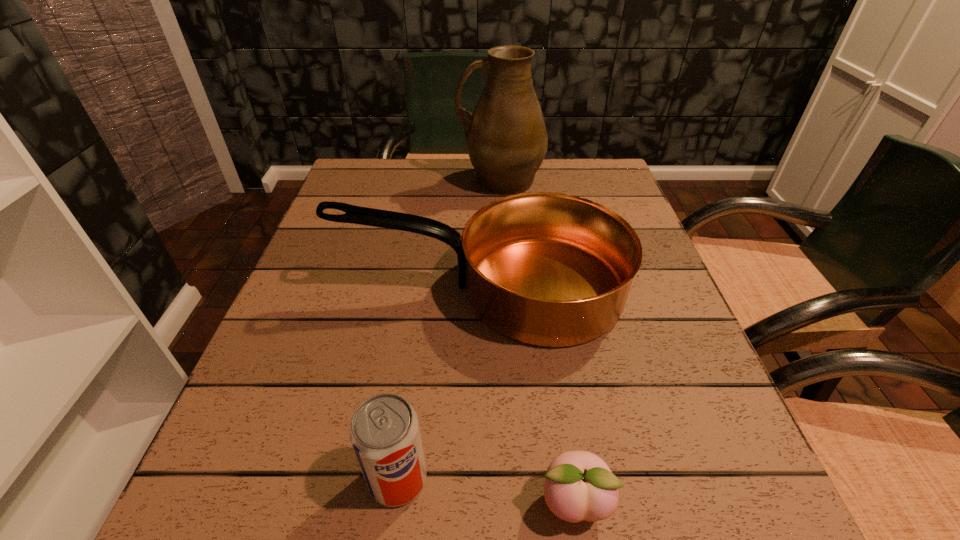
The width and height of the screenshot is (960, 540). In order to click on object that stands as the closest to the tallest object in this screenshot , I will do click(x=547, y=269).

Where is `object that is the closest to the soda`? Image resolution: width=960 pixels, height=540 pixels. object that is the closest to the soda is located at coordinates (579, 485).

I want to click on vacant space that satisfies the following two spatial constraints: 1. on the handle side of the peach; 2. on the left side of the frying pan, so click(x=484, y=502).